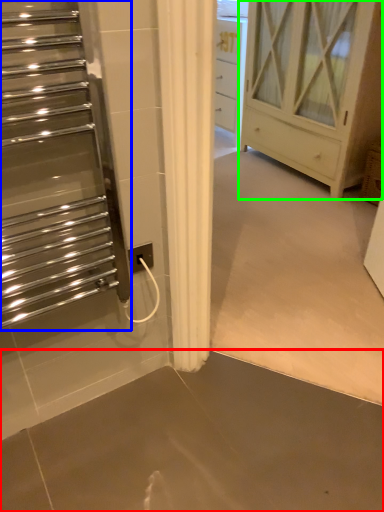
Question: Which is farther away from concrete (highlighted by a red box)? escalator (highlighted by a blue box) or chest of drawers (highlighted by a green box)?

Choices:
 (A) escalator
 (B) chest of drawers

Answer: (B)